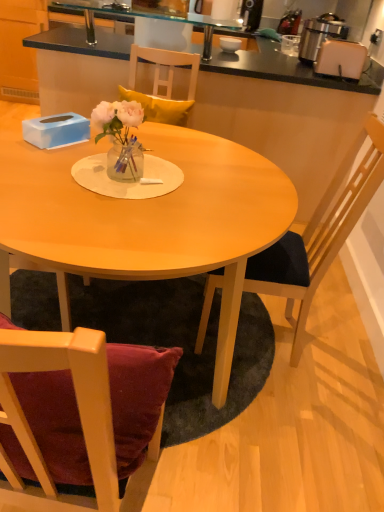
I want to click on vacant space to the right of clear glass vase at center, so click(176, 178).